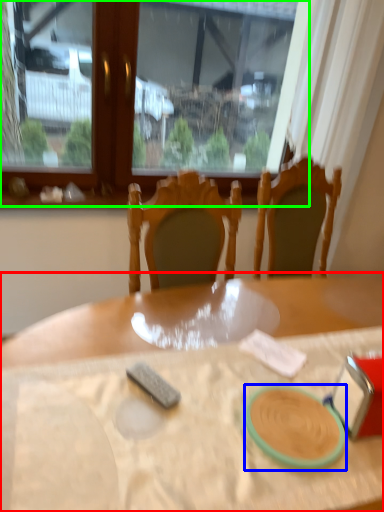
Question: Based on their relative distances, which object is nearer to table (highlighted by a red box)? Choose from tableware (highlighted by a blue box) and window (highlighted by a green box).

Choices:
 (A) tableware
 (B) window

Answer: (A)